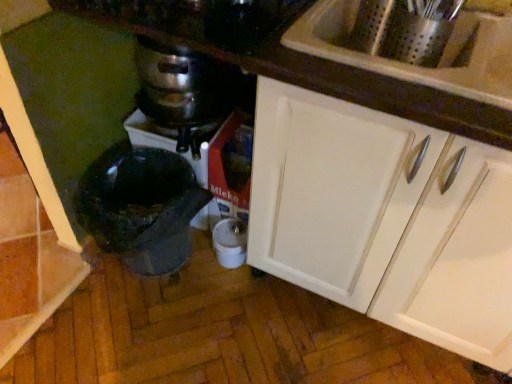
Question: In the image, is white glossy cabinet at upper right positioned in front of or behind stainless steel pot at center?

Choices:
 (A) front
 (B) behind

Answer: (A)

Question: From the image's perspective, is white glossy cabinet at upper right above or below stainless steel pot at center?

Choices:
 (A) above
 (B) below

Answer: (B)

Question: Which object is the closest to the black matte mortar at lower left, which is the second appliance in right-to-left order?

Choices:
 (A) white plastic container at lower center, the first appliance in the right-to-left sequence
 (B) white glossy cabinet at upper right
 (C) white glossy sink at upper right
 (D) stainless steel pot at center

Answer: (D)

Question: Estimate the real-world distances between objects in this image. Which object is closer to the white glossy sink at upper right?

Choices:
 (A) stainless steel pot at center
 (B) white plastic container at lower center, marked as the 2th appliance in a left-to-right arrangement
 (C) black matte mortar at lower left, which is the second appliance in right-to-left order
 (D) white glossy cabinet at upper right

Answer: (D)